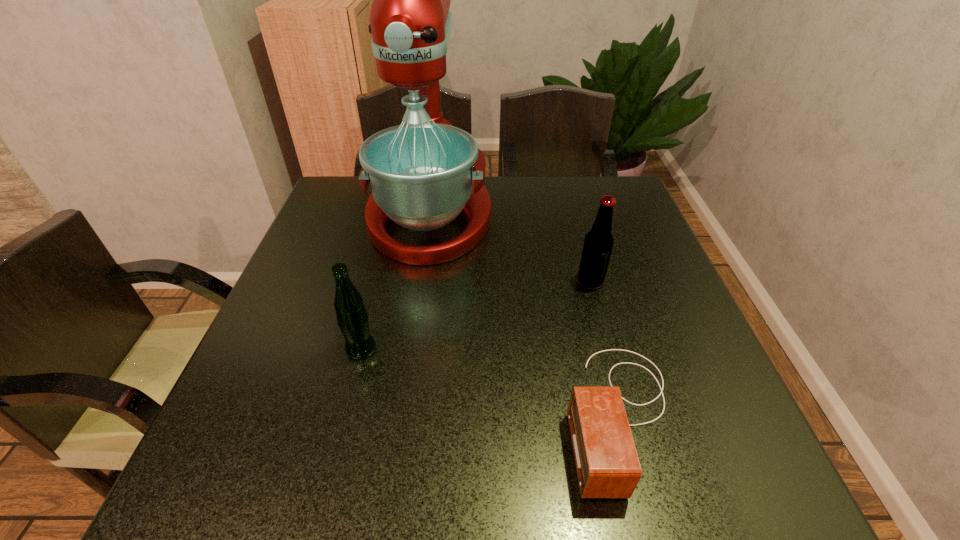
The width and height of the screenshot is (960, 540). In order to click on free space at the far left corner of the desktop in this screenshot , I will do tap(361, 205).

Locate an element on the screen. The width and height of the screenshot is (960, 540). free space that is in between the nearer beer bottle and the shortest object is located at coordinates (491, 382).

Where is `vacant area that lies between the left beer bottle and the mixer`? vacant area that lies between the left beer bottle and the mixer is located at coordinates (396, 282).

Where is `empty space between the right beer bottle and the shortest object`? empty space between the right beer bottle and the shortest object is located at coordinates (606, 348).

The height and width of the screenshot is (540, 960). Find the location of `empty space that is in between the radio receiver and the nearer beer bottle`. empty space that is in between the radio receiver and the nearer beer bottle is located at coordinates (491, 382).

Find the location of a particular element. empty location between the radio receiver and the left beer bottle is located at coordinates (x=491, y=382).

Find the location of a particular element. The image size is (960, 540). vacant area that lies between the farthest object and the nearer beer bottle is located at coordinates (396, 282).

Where is `free spot between the radio receiver and the tallest object`? free spot between the radio receiver and the tallest object is located at coordinates (525, 315).

The width and height of the screenshot is (960, 540). What are the coordinates of `free spot between the tallest object and the right beer bottle` in the screenshot? It's located at (510, 249).

You are a GUI agent. You are given a task and a screenshot of the screen. Output one action in this format:
    pyautogui.click(x=<x>, y=<y>)
    Task: Click on the free space between the tallest object and the radio receiver
    The image size is (960, 540).
    Given the screenshot: What is the action you would take?
    tap(525, 315)